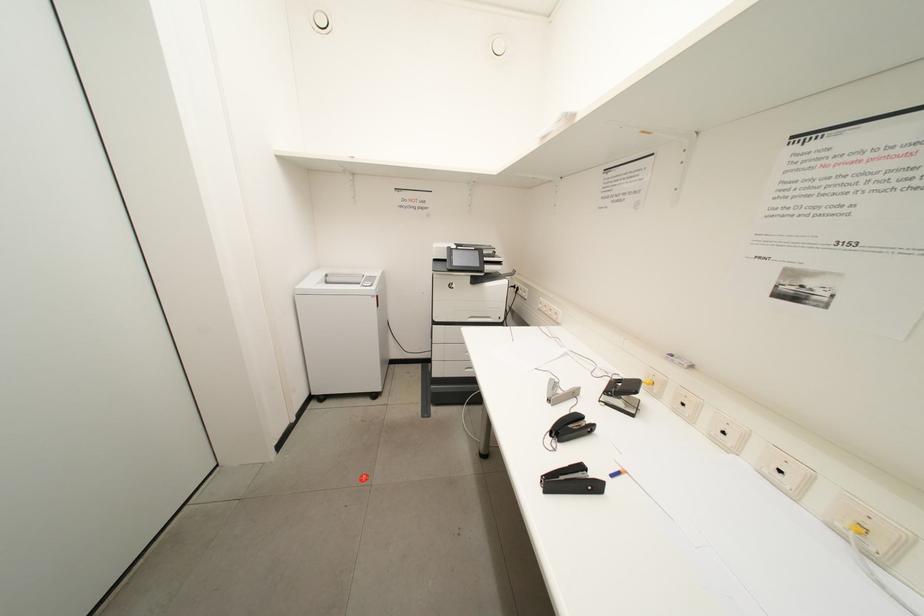
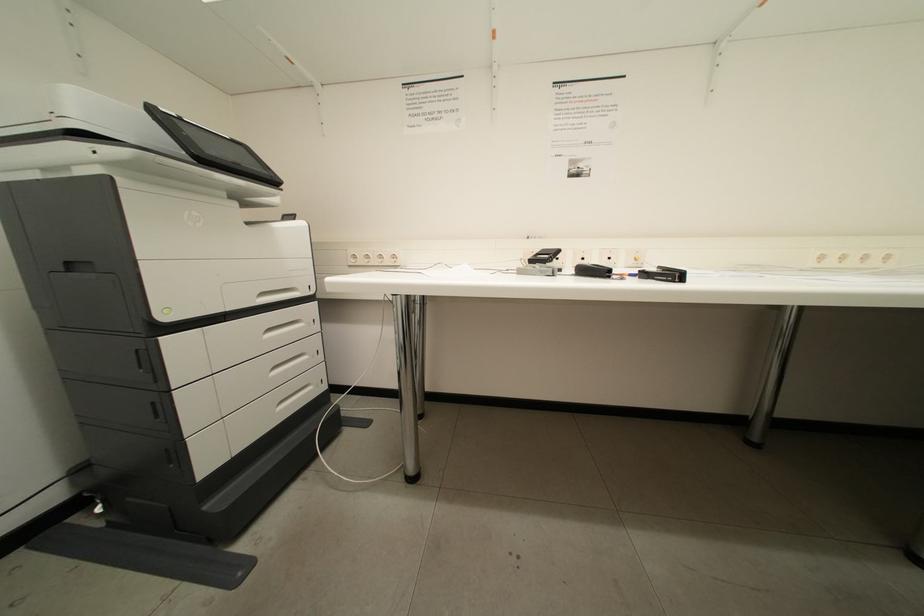
Question: How did the camera likely rotate?

Choices:
 (A) Left
 (B) Right
 (C) Up
 (D) Down

Answer: (B)